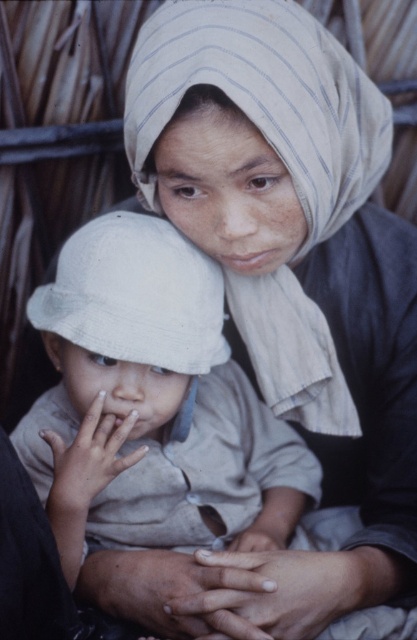
Is white cotton hat at center wider than white fabric hat at center?

Yes, white cotton hat at center is wider than white fabric hat at center.

From the picture: Is white cotton hat at center to the right of white fabric hat at center from the viewer's perspective?

Yes, white cotton hat at center is to the right of white fabric hat at center.

The width and height of the screenshot is (417, 640). What do you see at coordinates (161, 397) in the screenshot?
I see `white cotton hat at center` at bounding box center [161, 397].

Where is `white cotton hat at center`? Image resolution: width=417 pixels, height=640 pixels. white cotton hat at center is located at coordinates (161, 397).